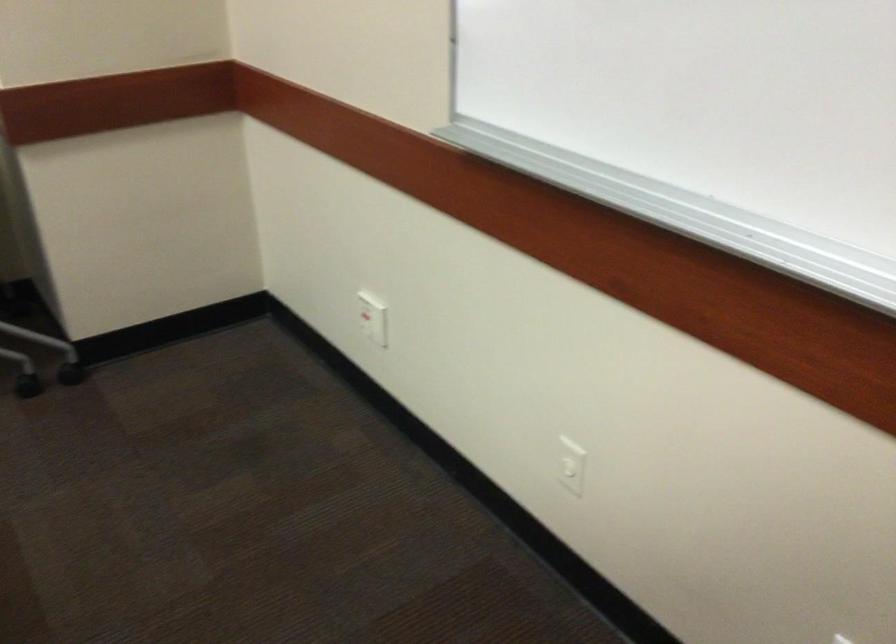
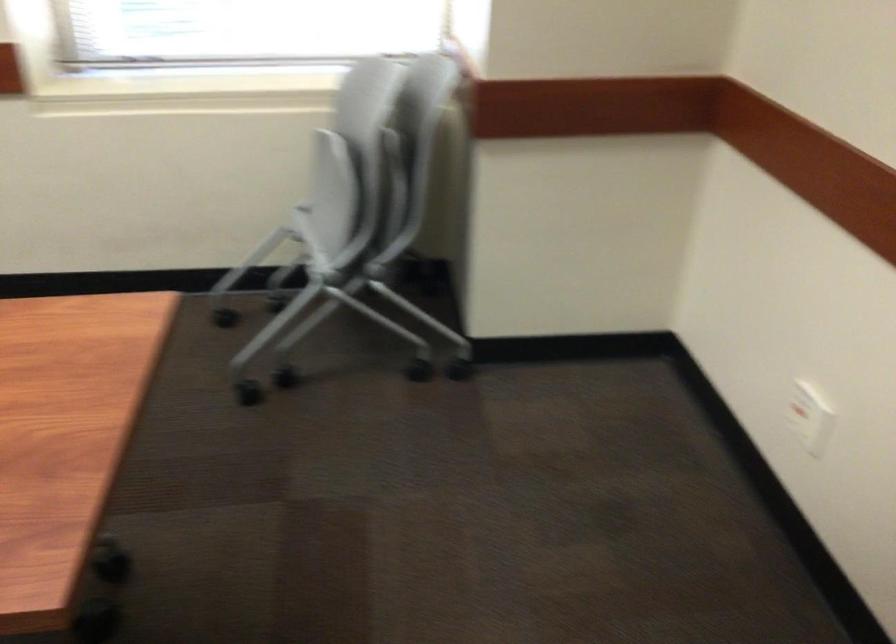
Where in the second image is the point corresponding to point 374,317 from the first image?

(808, 415)